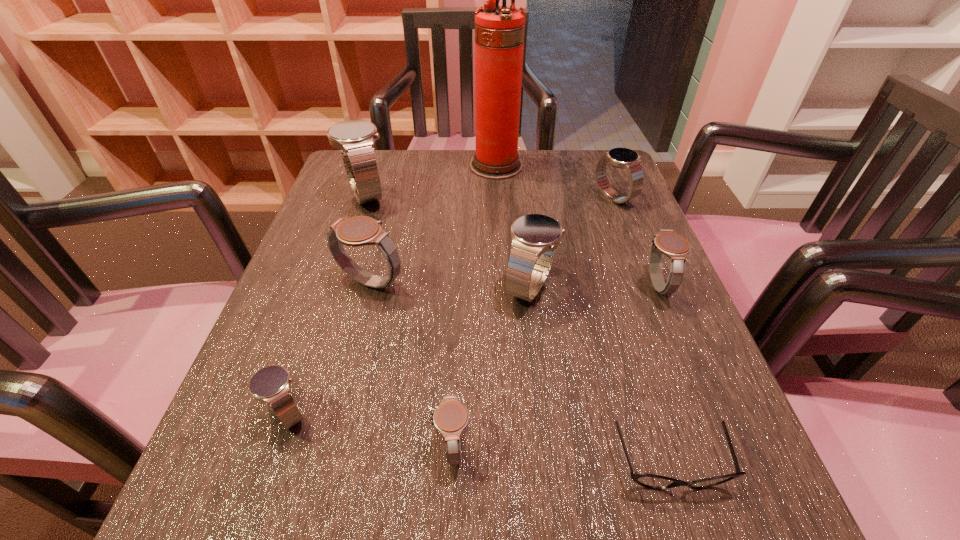
In order to click on the smallest gray watch in this screenshot , I will do `click(450, 418)`.

Find the location of `spectacles`. spectacles is located at coordinates (647, 480).

At what (x,y) coordinates should I click in order to perform the action: click on black spectacles. Please return your answer as a coordinate pair (x, y). Looking at the image, I should click on (647, 480).

In order to click on blank space located at the discharge end of the fire extinguisher in this screenshot , I will do click(401, 166).

Where is `free location located 0.310m at the discharge end of the fire extinguisher`? Image resolution: width=960 pixels, height=540 pixels. free location located 0.310m at the discharge end of the fire extinguisher is located at coordinates (351, 166).

At what (x,y) coordinates should I click in order to perform the action: click on vacant space located 0.120m at the discharge end of the fire extinguisher. Please return your answer as a coordinate pair (x, y). The width and height of the screenshot is (960, 540). Looking at the image, I should click on (424, 166).

At what (x,y) coordinates should I click in order to perform the action: click on free location located on the right of the eighth shortest object. Please return your answer as a coordinate pair (x, y). Image resolution: width=960 pixels, height=540 pixels. Looking at the image, I should click on (457, 195).

Where is `free spot located on the left of the fifth watch from left to right`? The width and height of the screenshot is (960, 540). free spot located on the left of the fifth watch from left to right is located at coordinates (471, 287).

The image size is (960, 540). I want to click on vacant position located on the back of the biggest gray watch, so click(395, 187).

This screenshot has height=540, width=960. Find the location of `vacant space located 0.170m on the front of the second smallest blue watch`. vacant space located 0.170m on the front of the second smallest blue watch is located at coordinates (638, 261).